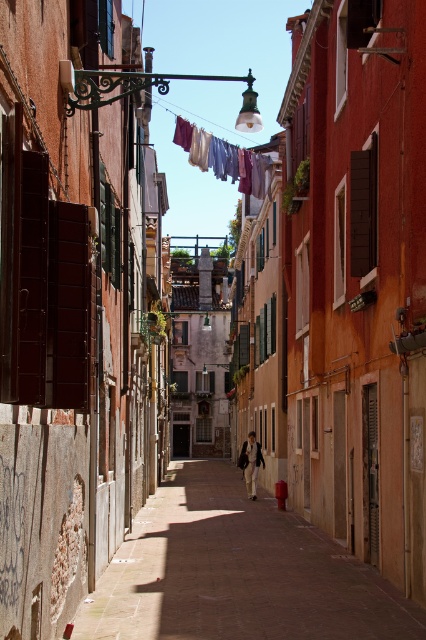
Question: Which point is closer to the camera taking this photo?

Choices:
 (A) (207, 531)
 (B) (221, 164)

Answer: (A)

Question: Can you confirm if smooth stone alley at center is wider than light beige fabric jacket at center?

Choices:
 (A) yes
 (B) no

Answer: (A)

Question: Which object is farther from the camera taking this photo?

Choices:
 (A) light beige fabric jacket at center
 (B) smooth stone alley at center
 (C) multicolored fabric at center

Answer: (A)

Question: Is smooth stone alley at center below multicolored fabric at center?

Choices:
 (A) yes
 (B) no

Answer: (A)

Question: Which object appears closest to the camera in this image?

Choices:
 (A) smooth stone alley at center
 (B) multicolored fabric at center

Answer: (A)

Question: Is smooth stone alley at center above multicolored fabric at center?

Choices:
 (A) no
 (B) yes

Answer: (A)